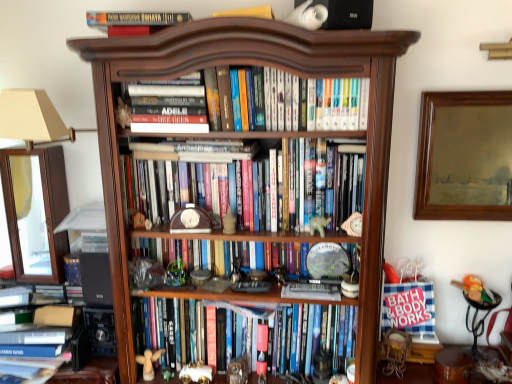
Question: Does hardcover book at center, positioned as the 3th book in top-to-bottom order, have a lesser height compared to white matte bear at center, which is the 6th toy in left-to-right order?

Choices:
 (A) no
 (B) yes

Answer: (A)

Question: Can you confirm if hardcover book at center, positioned as the 3th book in top-to-bottom order, is positioned to the right of white matte bear at center, the second toy when ordered from right to left?

Choices:
 (A) no
 (B) yes

Answer: (A)

Question: Considering the relative sizes of hardcover book at center, positioned as the 3th book in top-to-bottom order, and white matte bear at center, the second toy when ordered from right to left, in the image provided, is hardcover book at center, positioned as the 3th book in top-to-bottom order, smaller than white matte bear at center, the second toy when ordered from right to left,?

Choices:
 (A) no
 (B) yes

Answer: (A)

Question: Does hardcover book at center, placed as the fourth book when sorted from bottom to top, appear on the left side of white matte bear at center, which is the 6th toy in left-to-right order?

Choices:
 (A) yes
 (B) no

Answer: (A)

Question: From a real-world perspective, is hardcover book at center, placed as the fourth book when sorted from bottom to top, positioned under white matte bear at center, which is the 6th toy in left-to-right order, based on gravity?

Choices:
 (A) no
 (B) yes

Answer: (A)

Question: Does hardcover book at center, positioned as the 3th book in top-to-bottom order, turn towards white matte bear at center, the second toy when ordered from right to left?

Choices:
 (A) no
 (B) yes

Answer: (A)

Question: Is hardcover book at center, positioned as the 3th book in top-to-bottom order, shorter than wooden clock at center, which is the fifth book from top to bottom?

Choices:
 (A) yes
 (B) no

Answer: (B)

Question: Is wooden clock at center, marked as the 2th book in a bottom-to-top arrangement, completely or partially inside hardcover book at center, placed as the fourth book when sorted from bottom to top?

Choices:
 (A) yes
 (B) no

Answer: (B)

Question: Is hardcover book at center, placed as the fourth book when sorted from bottom to top, at the right side of wooden clock at center, which is the fifth book from top to bottom?

Choices:
 (A) yes
 (B) no

Answer: (B)

Question: Is hardcover book at center, placed as the fourth book when sorted from bottom to top, facing away from wooden clock at center, which is the fifth book from top to bottom?

Choices:
 (A) no
 (B) yes

Answer: (A)

Question: Does hardcover book at center, positioned as the 3th book in top-to-bottom order, have a greater height compared to wooden clock at center, marked as the 2th book in a bottom-to-top arrangement?

Choices:
 (A) no
 (B) yes

Answer: (B)

Question: Is the depth of wooden clock at center, which is the fifth book from top to bottom, less than that of hardcover book at top, the sixth book in the bottom-to-top sequence?

Choices:
 (A) yes
 (B) no

Answer: (B)